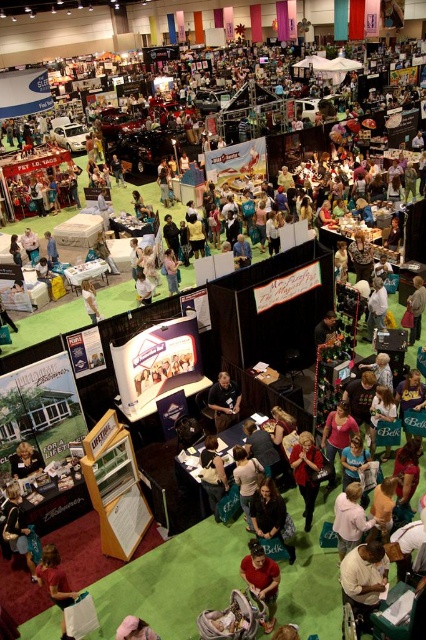
Can you confirm if matte black shirt at lower left is thinner than dark green fabric bag at center?

In fact, matte black shirt at lower left might be wider than dark green fabric bag at center.

What do you see at coordinates (20, 531) in the screenshot?
I see `matte black shirt at lower left` at bounding box center [20, 531].

You are a GUI agent. You are given a task and a screenshot of the screen. Output one action in this format:
    pyautogui.click(x=<x>, y=<y>)
    Task: Click on the matte black shirt at lower left
    The width and height of the screenshot is (426, 640).
    Given the screenshot: What is the action you would take?
    pyautogui.click(x=20, y=531)

Does white matte shirt at lower center appear under golden hair at center?

Yes, white matte shirt at lower center is below golden hair at center.

Does white matte shirt at lower center come behind golden hair at center?

That is False.

Which is behind, point (354, 561) or point (307, 524)?

Point (307, 524)

The image size is (426, 640). Identify the location of white matte shirt at lower center. (362, 579).

Based on the photo, can you confirm if white matte shirt at lower center is thinner than black leather jacket at center?

Indeed, white matte shirt at lower center has a lesser width compared to black leather jacket at center.

Where is `white matte shirt at lower center`? Image resolution: width=426 pixels, height=640 pixels. white matte shirt at lower center is located at coordinates (362, 579).

What are the coordinates of `white matte shirt at lower center` in the screenshot? It's located at pyautogui.click(x=362, y=579).